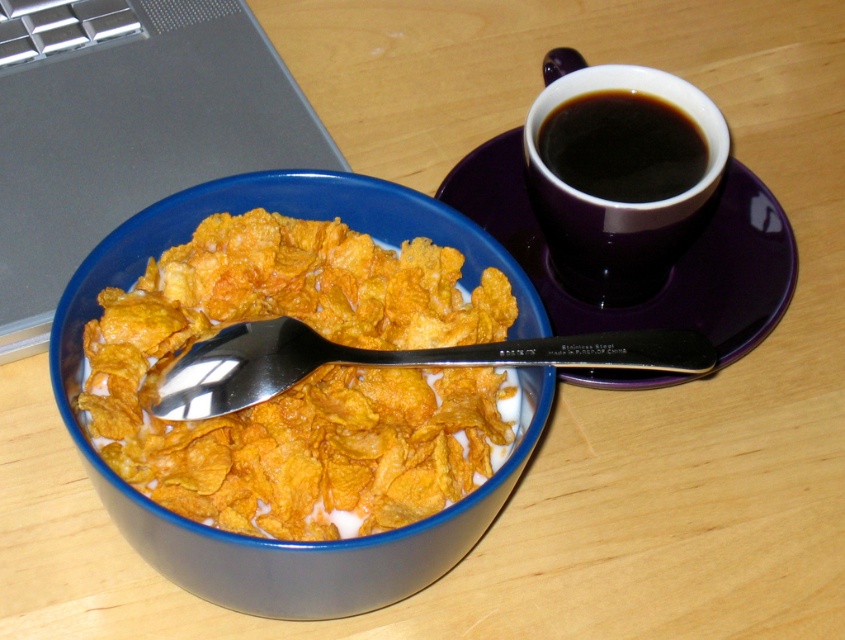
Is silver metallic laptop at upper left positioned before black glossy cup at upper right?

No.

Who is positioned more to the left, silver metallic laptop at upper left or black glossy cup at upper right?

From the viewer's perspective, silver metallic laptop at upper left appears more on the left side.

Between point (199, 80) and point (644, 148), which one is positioned in front?

Point (644, 148)

This screenshot has height=640, width=845. Find the location of `silver metallic laptop at upper left`. silver metallic laptop at upper left is located at coordinates (128, 132).

Is point (473, 467) positioned after point (662, 189)?

No, (473, 467) is in front of (662, 189).

Who is higher up, yellow matte cereal at center or black glossy cup at upper right?

black glossy cup at upper right is above.

Image resolution: width=845 pixels, height=640 pixels. In order to click on yellow matte cereal at center in this screenshot , I will do `click(303, 380)`.

You are a GUI agent. You are given a task and a screenshot of the screen. Output one action in this format:
    pyautogui.click(x=<x>, y=<y>)
    Task: Click on the yellow matte cereal at center
    Image resolution: width=845 pixels, height=640 pixels.
    Given the screenshot: What is the action you would take?
    pyautogui.click(x=303, y=380)

Between silver metallic laptop at upper left and black glossy mug at upper right, which one has more height?

silver metallic laptop at upper left is taller.

Does silver metallic laptop at upper left have a lesser height compared to black glossy mug at upper right?

In fact, silver metallic laptop at upper left may be taller than black glossy mug at upper right.

The image size is (845, 640). Find the location of `silver metallic laptop at upper left`. silver metallic laptop at upper left is located at coordinates (128, 132).

The height and width of the screenshot is (640, 845). I want to click on silver metallic laptop at upper left, so click(128, 132).